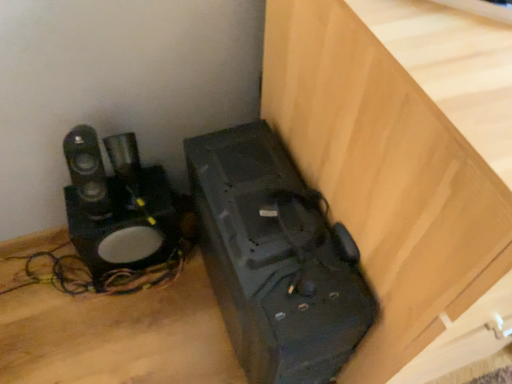
Identify the location of free spot to the left of matte black speaker at lower right. Image resolution: width=512 pixels, height=384 pixels. (147, 321).